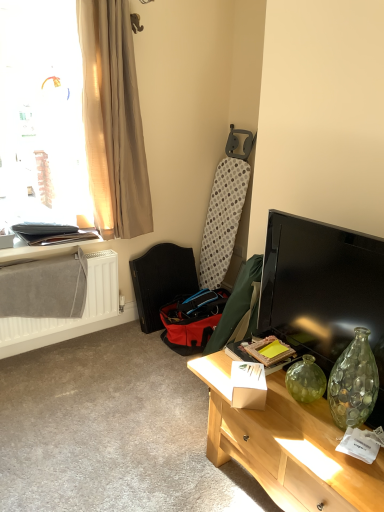
Question: In terms of width, does white cardboard box at center look wider or thinner when compared to light wood desk at lower right?

Choices:
 (A) thin
 (B) wide

Answer: (A)

Question: Is white cardboard box at center bigger or smaller than light wood desk at lower right?

Choices:
 (A) big
 (B) small

Answer: (B)

Question: Which of these objects is positioned farthest from the beige sheer curtain at upper left?

Choices:
 (A) matte black tv at right
 (B) black leather swivel chair at lower left
 (C) light wood desk at lower right
 (D) translucent beige curtain at upper left
 (E) white cardboard box at center

Answer: (C)

Question: Which is farther from the matte black tv at right?

Choices:
 (A) beige sheer curtain at upper left
 (B) light wood desk at lower right
 (C) black leather swivel chair at lower left
 (D) translucent beige curtain at upper left
 (E) white textured radiator at left

Answer: (D)